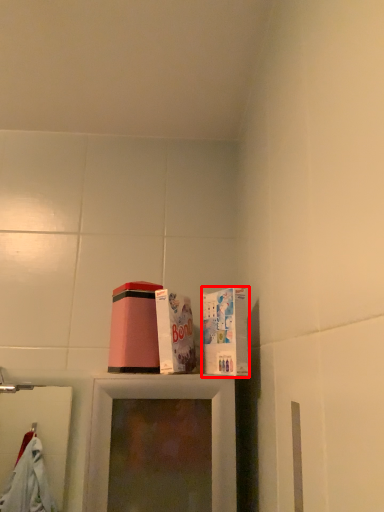
Question: Considering the relative positions of box (annotated by the red box) and box in the image provided, where is box (annotated by the red box) located with respect to the staircase?

Choices:
 (A) left
 (B) right

Answer: (B)